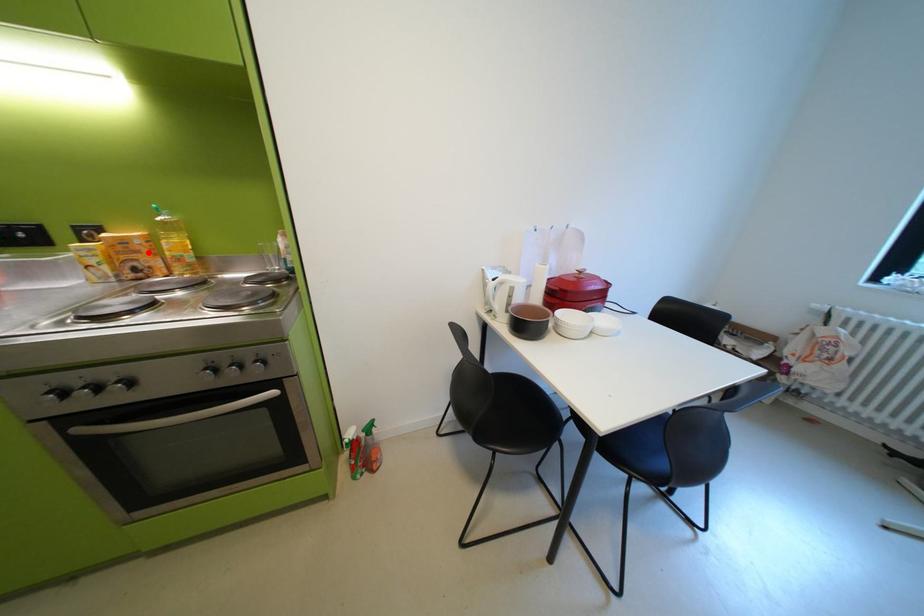
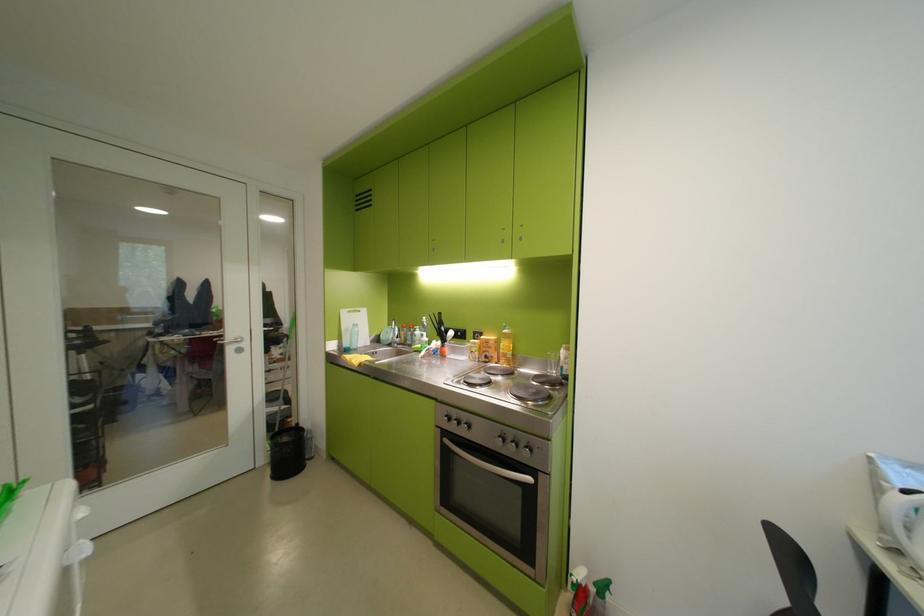
In the second image, find the point that corresponds to the highlighted location in the first image.

(501, 349)